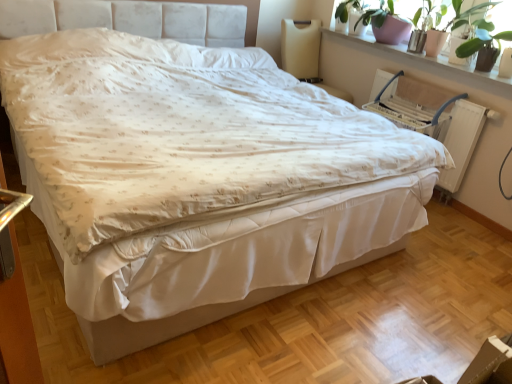
Question: Considering the positions of beige fabric swivel chair at upper right and green leafy plant at upper right, the first plant in the front-to-back sequence, in the image, is beige fabric swivel chair at upper right wider or thinner than green leafy plant at upper right, the first plant in the front-to-back sequence,?

Choices:
 (A) wide
 (B) thin

Answer: (A)

Question: Considering the positions of point (312, 36) and point (459, 56), is point (312, 36) closer or farther from the camera than point (459, 56)?

Choices:
 (A) farther
 (B) closer

Answer: (A)

Question: Which of these objects is positioned closest to the beige fabric swivel chair at upper right?

Choices:
 (A) green glossy plant at upper right, which is the first plant in back-to-front order
 (B) green leafy plant at upper right, the 2th plant viewed from the back
 (C) white wood window sill at upper right

Answer: (C)

Question: Which object is the farthest from the green glossy plant at upper right, the 2th plant positioned from the front?

Choices:
 (A) green leafy plant at upper right, the 2th plant viewed from the back
 (B) white wood window sill at upper right
 (C) beige fabric swivel chair at upper right

Answer: (C)